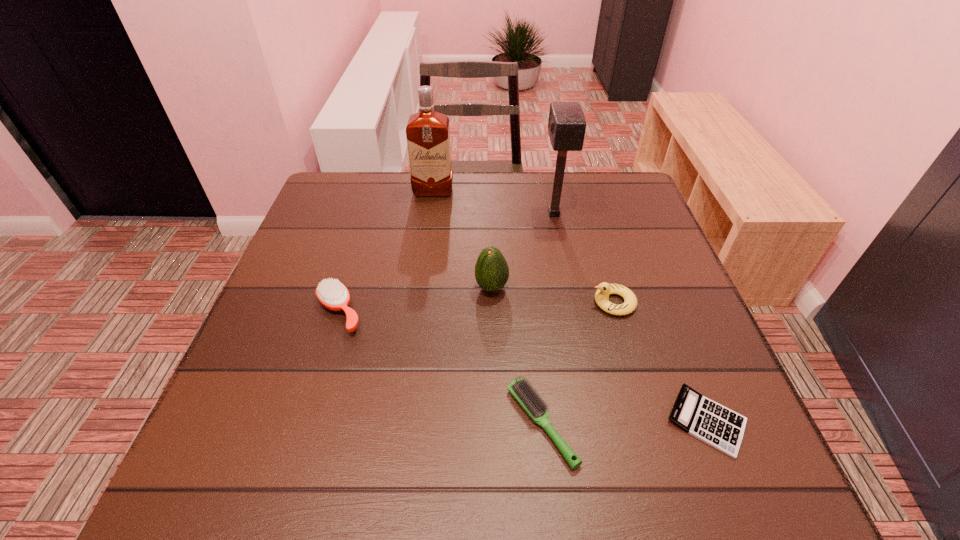
Where is `liquor that is at the far edge`? The image size is (960, 540). liquor that is at the far edge is located at coordinates (428, 133).

I want to click on mallet that is at the far edge, so click(566, 126).

The image size is (960, 540). In order to click on hairbrush that is positioned at the near edge in this screenshot , I will do `click(533, 405)`.

The height and width of the screenshot is (540, 960). Identify the location of calculator that is at the near edge. (716, 425).

Identify the location of object at the left edge. The image size is (960, 540). (332, 294).

Where is `duckling that is positioned at the right edge`? This screenshot has width=960, height=540. duckling that is positioned at the right edge is located at coordinates (604, 289).

Find the location of a particular element. calculator that is positioned at the right edge is located at coordinates coord(716,425).

Image resolution: width=960 pixels, height=540 pixels. I want to click on object that is at the near right corner, so click(x=716, y=425).

In the image, there is a desktop. At what (x,y) coordinates should I click in order to perform the action: click on vacant space at the far edge. Please return your answer as a coordinate pair (x, y). Looking at the image, I should click on (581, 205).

Image resolution: width=960 pixels, height=540 pixels. Identify the location of vacant region at the near edge of the desktop. (526, 471).